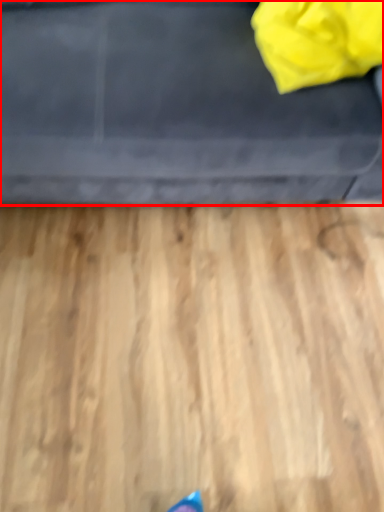
Question: From the image's perspective, where is furniture (annotated by the red box) located relative to bag?

Choices:
 (A) above
 (B) below

Answer: (A)